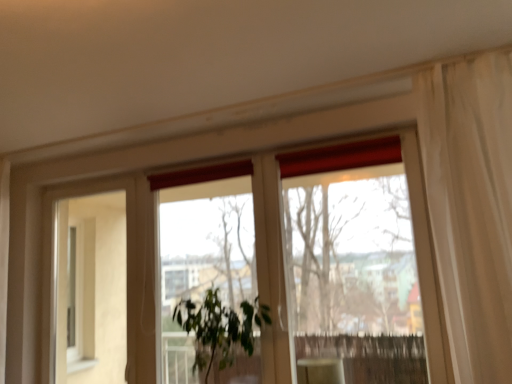
The height and width of the screenshot is (384, 512). I want to click on beige matte screen door at left, so click(85, 281).

Measure the distance between green leafy plant at center and camera.

green leafy plant at center is 7.28 feet away from camera.

Locate an element on the screen. matte white cabinet at lower center is located at coordinates click(x=320, y=371).

Which of these two, green leafy plant at center or matte white cabinet at lower center, is wider?

Wider between the two is green leafy plant at center.

Consider the image. Does green leafy plant at center turn towards matte white cabinet at lower center?

No, green leafy plant at center is not turned towards matte white cabinet at lower center.

Is green leafy plant at center positioned far away from matte white cabinet at lower center?

No, green leafy plant at center is not far away from matte white cabinet at lower center.

In the image, is matte white cabinet at lower center on the left side or the right side of green leafy plant at center?

From the image, it's evident that matte white cabinet at lower center is to the right of green leafy plant at center.

Image resolution: width=512 pixels, height=384 pixels. In order to click on houseplant in front of the matte white cabinet at lower center in this screenshot , I will do `click(219, 329)`.

Between matte white cabinet at lower center and green leafy plant at center, which one is positioned behind?

matte white cabinet at lower center is more distant.

From a real-world perspective, does beige matte screen door at left stand above transparent glass window at center?

No, from a real-world perspective, beige matte screen door at left is not over transparent glass window at center

Is beige matte screen door at left positioned with its back to transparent glass window at center?

No, beige matte screen door at left is not facing the opposite direction of transparent glass window at center.

Looking at this image, how much distance is there between beige matte screen door at left and transparent glass window at center?

beige matte screen door at left and transparent glass window at center are 22.98 inches apart.

Can you confirm if beige matte screen door at left is thinner than transparent glass window at center?

Yes.

Does beige matte screen door at left have a greater width compared to matte white cabinet at lower center?

Incorrect, the width of beige matte screen door at left does not surpass that of matte white cabinet at lower center.

Considering the points (91, 273) and (331, 383), which point is in front, point (91, 273) or point (331, 383)?

The point (331, 383) is more forward.

Are beige matte screen door at left and matte white cabinet at lower center located far from each other?

That's right, there is a large distance between beige matte screen door at left and matte white cabinet at lower center.

From a real-world perspective, is beige matte screen door at left located beneath matte white cabinet at lower center?

No, from a real-world perspective, beige matte screen door at left is not below matte white cabinet at lower center.

From a real-world perspective, does matte white cabinet at lower center sit lower than beige matte screen door at left?

Yes, from a real-world perspective, matte white cabinet at lower center is below beige matte screen door at left.

Looking at this image, is matte white cabinet at lower center next to beige matte screen door at left and touching it?

matte white cabinet at lower center and beige matte screen door at left are not in contact.

From the image's perspective, is matte white cabinet at lower center under beige matte screen door at left?

Yes.

Considering their positions, is transparent glass window at center located in front of or behind beige matte screen door at left?

transparent glass window at center is positioned closer to the viewer than beige matte screen door at left.

Looking at this image, who is taller, transparent glass window at center or beige matte screen door at left?

Standing taller between the two is beige matte screen door at left.

From a real-world perspective, is transparent glass window at center below beige matte screen door at left?

Incorrect, from a real-world perspective, transparent glass window at center is higher than beige matte screen door at left.

Considering the sizes of objects transparent glass window at center and beige matte screen door at left in the image provided, who is bigger, transparent glass window at center or beige matte screen door at left?

transparent glass window at center.

Which object is positioned more to the left, transparent glass window at center or green leafy plant at center?

green leafy plant at center.

Is transparent glass window at center next to green leafy plant at center?

No, transparent glass window at center is not beside green leafy plant at center.

Is transparent glass window at center wider than green leafy plant at center?

In fact, transparent glass window at center might be narrower than green leafy plant at center.

From the picture: Between transparent glass window at center and green leafy plant at center, which one has more height?

Standing taller between the two is transparent glass window at center.

This screenshot has width=512, height=384. What are the coordinates of `houseplant in front of the matte white cabinet at lower center` in the screenshot? It's located at (x=219, y=329).

You are a GUI agent. You are given a task and a screenshot of the screen. Output one action in this format:
    pyautogui.click(x=<x>, y=<y>)
    Task: Click on the houseplant that appears above the matte white cabinet at lower center (from a real-world perspective)
    This screenshot has width=512, height=384.
    Given the screenshot: What is the action you would take?
    pyautogui.click(x=219, y=329)

When comparing their distances from transparent glass window at center, does beige matte screen door at left or matte white cabinet at lower center seem further?

matte white cabinet at lower center is positioned further to the anchor transparent glass window at center.

Based on their spatial positions, is matte white cabinet at lower center or transparent glass window at center closer to green leafy plant at center?

matte white cabinet at lower center is positioned closer to the anchor green leafy plant at center.

From the picture: Considering their positions, is transparent glass window at center positioned closer to beige matte screen door at left than green leafy plant at center?

transparent glass window at center.

When comparing their distances from green leafy plant at center, does transparent glass window at center or matte white cabinet at lower center seem further?

transparent glass window at center is further to green leafy plant at center.

From the picture: Which object lies further to the anchor point matte white cabinet at lower center, beige matte screen door at left or green leafy plant at center?

beige matte screen door at left is positioned further to the anchor matte white cabinet at lower center.

Looking at the image, which one is located closer to transparent glass window at center, matte white cabinet at lower center or green leafy plant at center?

green leafy plant at center.

When comparing their distances from beige matte screen door at left, does matte white cabinet at lower center or transparent glass window at center seem further?

matte white cabinet at lower center lies further to beige matte screen door at left than the other object.

Considering their positions, is beige matte screen door at left positioned closer to green leafy plant at center than matte white cabinet at lower center?

Based on the image, matte white cabinet at lower center appears to be nearer to green leafy plant at center.

The width and height of the screenshot is (512, 384). Find the location of `houseplant between beige matte screen door at left and transparent glass window at center in the horizontal direction`. houseplant between beige matte screen door at left and transparent glass window at center in the horizontal direction is located at coordinates (219, 329).

Find the location of a particular element. This screenshot has height=384, width=512. houseplant located between beige matte screen door at left and matte white cabinet at lower center in the left-right direction is located at coordinates (219, 329).

This screenshot has height=384, width=512. Identify the location of window located between beige matte screen door at left and matte white cabinet at lower center in the left-right direction. (127, 264).

At what (x,y) coordinates should I click in order to perform the action: click on houseplant that lies between transparent glass window at center and matte white cabinet at lower center from top to bottom. Please return your answer as a coordinate pair (x, y). This screenshot has width=512, height=384. Looking at the image, I should click on (219, 329).